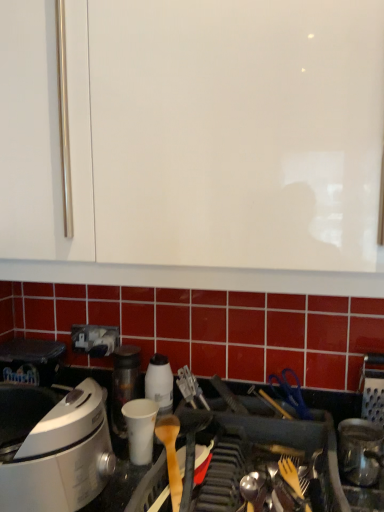
This screenshot has width=384, height=512. Describe the element at coordinates (160, 383) in the screenshot. I see `white glossy container at center, which is counted as the first kitchen appliance, starting from the back` at that location.

Identify the location of white glossy container at center, positioned as the second kitchen appliance in front-to-back order. (160, 383).

The width and height of the screenshot is (384, 512). Describe the element at coordinates (360, 451) in the screenshot. I see `shiny metallic canister at lower right, the 1th kitchen appliance from the right` at that location.

Find the location of a particular element. white glossy container at center, which is counted as the first kitchen appliance, starting from the back is located at coordinates (160, 383).

Is the position of white glossy container at center, which is counted as the first kitchen appliance, starting from the back, more distant than that of shiny metallic canister at lower right, the 2th kitchen appliance when ordered from back to front?

Yes, white glossy container at center, which is counted as the first kitchen appliance, starting from the back, is behind shiny metallic canister at lower right, the 2th kitchen appliance when ordered from back to front.

From the image's perspective, is white glossy container at center, positioned as the second kitchen appliance in front-to-back order, below shiny metallic canister at lower right, positioned as the second kitchen appliance in left-to-right order?

No.

Consider the image. Considering the sizes of objects white glossy container at center, which is counted as the first kitchen appliance, starting from the back, and shiny metallic canister at lower right, the first kitchen appliance in the front-to-back sequence, in the image provided, who is bigger, white glossy container at center, which is counted as the first kitchen appliance, starting from the back, or shiny metallic canister at lower right, the first kitchen appliance in the front-to-back sequence,?

With larger size is shiny metallic canister at lower right, the first kitchen appliance in the front-to-back sequence.

The height and width of the screenshot is (512, 384). Identify the location of kitchen appliance located below the white glossy container at center, arranged as the 2th kitchen appliance when viewed from the right (from the image's perspective). click(x=360, y=451).

From the image's perspective, which is above, shiny metallic canister at lower right, the 2th kitchen appliance when ordered from back to front, or white glossy container at center, positioned as the second kitchen appliance in front-to-back order?

white glossy container at center, positioned as the second kitchen appliance in front-to-back order, from the image's perspective.

Would you say white glossy container at center, arranged as the 2th kitchen appliance when viewed from the right, is part of shiny metallic canister at lower right, the first kitchen appliance in the front-to-back sequence,'s contents?

No, white glossy container at center, arranged as the 2th kitchen appliance when viewed from the right, is not a part of shiny metallic canister at lower right, the first kitchen appliance in the front-to-back sequence.

Considering the positions of points (348, 469) and (146, 380), is point (348, 469) farther from camera compared to point (146, 380)?

No, it is in front of (146, 380).

Looking at the image, does white glossy container at center, which is counted as the first kitchen appliance, starting from the back, seem bigger or smaller compared to white paper cup at center?

Considering their sizes, white glossy container at center, which is counted as the first kitchen appliance, starting from the back, takes up more space than white paper cup at center.

Looking at this image, is white glossy container at center, which appears as the first kitchen appliance when viewed from the left, facing away from white paper cup at center?

That's not correct — white glossy container at center, which appears as the first kitchen appliance when viewed from the left, is not looking away from white paper cup at center.

Is white glossy container at center, which is counted as the first kitchen appliance, starting from the back, positioned before white paper cup at center?

That is False.

Considering the sizes of white glossy container at center, which appears as the first kitchen appliance when viewed from the left, and white paper cup at center in the image, is white glossy container at center, which appears as the first kitchen appliance when viewed from the left, wider or thinner than white paper cup at center?

Clearly, white glossy container at center, which appears as the first kitchen appliance when viewed from the left, has less width compared to white paper cup at center.

Is white paper cup at center beside white glossy container at center, positioned as the second kitchen appliance in front-to-back order?

Indeed, white paper cup at center and white glossy container at center, positioned as the second kitchen appliance in front-to-back order, are beside each other and touching.

Identify the location of appliance below the white glossy container at center, which is counted as the first kitchen appliance, starting from the back (from the image's perspective). (140, 429).

From the image's perspective, relative to white glossy container at center, positioned as the second kitchen appliance in front-to-back order, is white paper cup at center above or below?

white paper cup at center is situated lower than white glossy container at center, positioned as the second kitchen appliance in front-to-back order, in the image.

Between point (141, 453) and point (155, 381), which one is positioned in front?

The point (141, 453) is closer.

Based on the photo, which is in front, white paper cup at center or shiny metallic canister at lower right, positioned as the second kitchen appliance in left-to-right order?

shiny metallic canister at lower right, positioned as the second kitchen appliance in left-to-right order, is closer to the camera.

Does white paper cup at center turn towards shiny metallic canister at lower right, the 2th kitchen appliance when ordered from back to front?

No, white paper cup at center is not facing towards shiny metallic canister at lower right, the 2th kitchen appliance when ordered from back to front.

Based on the photo, who is taller, white paper cup at center or shiny metallic canister at lower right, the 1th kitchen appliance from the right?

shiny metallic canister at lower right, the 1th kitchen appliance from the right.

Is shiny metallic canister at lower right, the 1th kitchen appliance from the right, not within white paper cup at center?

Yes, shiny metallic canister at lower right, the 1th kitchen appliance from the right, is not within white paper cup at center.

Which of these two, shiny metallic canister at lower right, the 1th kitchen appliance from the right, or white paper cup at center, is bigger?

With larger size is shiny metallic canister at lower right, the 1th kitchen appliance from the right.

Which is more to the right, shiny metallic canister at lower right, the first kitchen appliance in the front-to-back sequence, or white paper cup at center?

Positioned to the right is shiny metallic canister at lower right, the first kitchen appliance in the front-to-back sequence.

The image size is (384, 512). Identify the location of the 2nd kitchen appliance counting from the right of the white paper cup at center. (360, 451).

Where is `kitchen appliance that appears in front of the white glossy container at center, positioned as the second kitchen appliance in front-to-back order`? The image size is (384, 512). kitchen appliance that appears in front of the white glossy container at center, positioned as the second kitchen appliance in front-to-back order is located at coordinates (360, 451).

Image resolution: width=384 pixels, height=512 pixels. In the image, there is a white glossy container at center, arranged as the 2th kitchen appliance when viewed from the right. In order to click on kitchen appliance below it (from a real-world perspective) in this screenshot , I will do `click(360, 451)`.

Based on their spatial positions, is white paper cup at center or shiny metallic canister at lower right, the 2th kitchen appliance when ordered from back to front, further from white glossy container at center, arranged as the 2th kitchen appliance when viewed from the right?

shiny metallic canister at lower right, the 2th kitchen appliance when ordered from back to front.

From the image, which object appears to be farther from shiny metallic canister at lower right, positioned as the second kitchen appliance in left-to-right order, white paper cup at center or white glossy container at center, arranged as the 2th kitchen appliance when viewed from the right?

white paper cup at center lies further to shiny metallic canister at lower right, positioned as the second kitchen appliance in left-to-right order, than the other object.

Based on their spatial positions, is shiny metallic canister at lower right, the first kitchen appliance in the front-to-back sequence, or white glossy container at center, arranged as the 2th kitchen appliance when viewed from the right, further from white paper cup at center?

shiny metallic canister at lower right, the first kitchen appliance in the front-to-back sequence, is further to white paper cup at center.

From the image, which object appears to be farther from white glossy container at center, arranged as the 2th kitchen appliance when viewed from the right, shiny metallic canister at lower right, the first kitchen appliance in the front-to-back sequence, or white paper cup at center?

The object further to white glossy container at center, arranged as the 2th kitchen appliance when viewed from the right, is shiny metallic canister at lower right, the first kitchen appliance in the front-to-back sequence.

When comparing their distances from shiny metallic canister at lower right, the 2th kitchen appliance when ordered from back to front, does white glossy container at center, which appears as the first kitchen appliance when viewed from the left, or white paper cup at center seem closer?

Based on the image, white glossy container at center, which appears as the first kitchen appliance when viewed from the left, appears to be nearer to shiny metallic canister at lower right, the 2th kitchen appliance when ordered from back to front.

Estimate the real-world distances between objects in this image. Which object is further from white paper cup at center, white glossy container at center, arranged as the 2th kitchen appliance when viewed from the right, or shiny metallic canister at lower right, the first kitchen appliance in the front-to-back sequence?

The object further to white paper cup at center is shiny metallic canister at lower right, the first kitchen appliance in the front-to-back sequence.

This screenshot has height=512, width=384. Find the location of `kitchen appliance between white paper cup at center and shiny metallic canister at lower right, the 1th kitchen appliance from the right`. kitchen appliance between white paper cup at center and shiny metallic canister at lower right, the 1th kitchen appliance from the right is located at coordinates click(x=160, y=383).